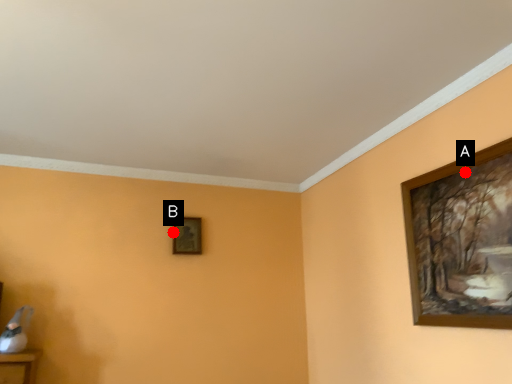
Question: Two points are circled on the image, labeled by A and B beside each circle. Which of the following is the closest to the observer?

Choices:
 (A) A is closer
 (B) B is closer

Answer: (A)